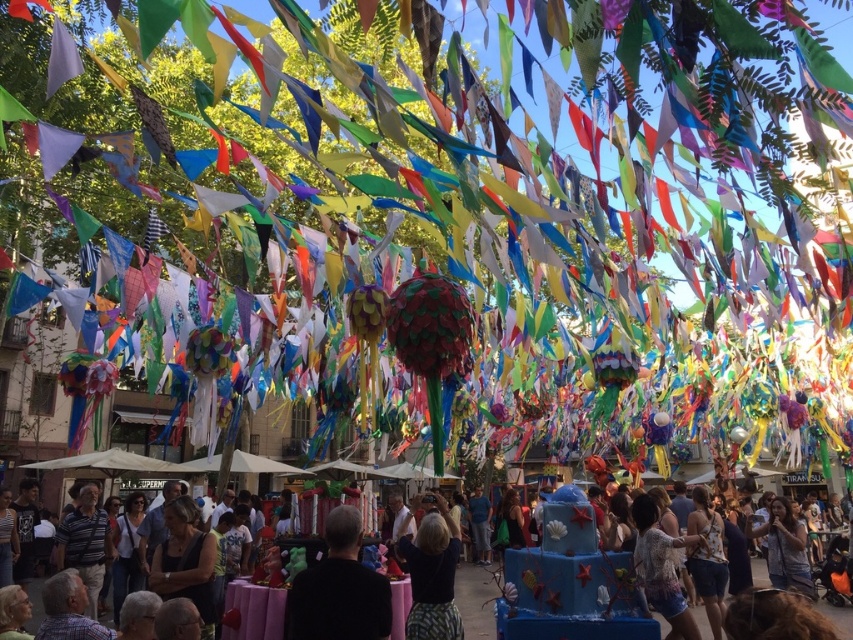
Question: Among these points, which one is nearest to the camera?

Choices:
 (A) (315, 600)
 (B) (753, 564)
 (C) (442, 608)

Answer: (A)

Question: Which object is the closest to the matte black shirt at center?

Choices:
 (A) dark blue fabric at center
 (B) black matte shirt at center

Answer: (A)

Question: Does dark blue fabric at center appear under matte black shirt at center?

Choices:
 (A) no
 (B) yes

Answer: (A)

Question: Does black matte shirt at center have a larger size compared to dark blue fabric at center?

Choices:
 (A) no
 (B) yes

Answer: (B)

Question: Is dark blue fabric at center positioned at the back of matte black shirt at center?

Choices:
 (A) no
 (B) yes

Answer: (A)

Question: Which point appears farthest from the camera in this image?

Choices:
 (A) (413, 593)
 (B) (764, 564)
 (C) (379, 620)

Answer: (B)